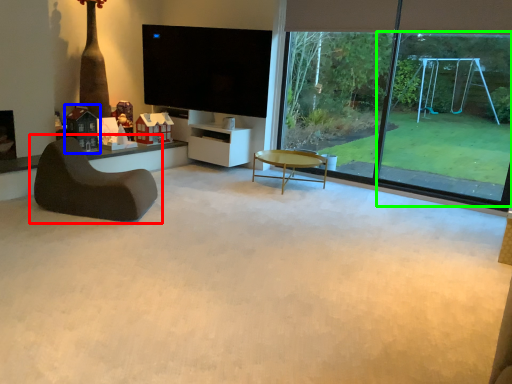
Question: Which object is positioned closest to chair (highlighted by a red box)? Select from toy (highlighted by a blue box) and window frame (highlighted by a green box).

Choices:
 (A) toy
 (B) window frame

Answer: (A)